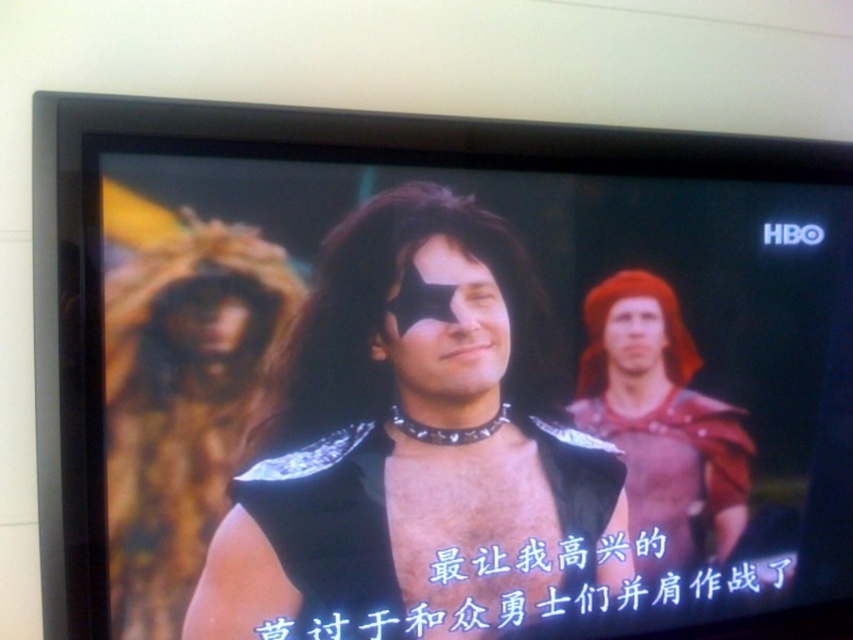
You are a character in the fantasy drama scene. You need to move from the shiny black armor at center to the red leather armor at right. Which direction should you move to reach it?

The shiny black armor at center is to the left of red leather armor at right, so you should move to the right to reach the red leather armor at right.

You are a costume designer preparing for a play. You have two armors to place on stage. The shiny black armor at center and the red leather armor at right. Which armor should you place closer to the audience to make it appear more dominant?

The shiny black armor at center is larger in size compared to the red leather armor at right. To make it appear more dominant, place it closer to the audience since its larger size will enhance its presence.

You are a character in the fantasy drama scene. You need to locate the shiny black armor at center to retrieve a hidden key. Based on the coordinates provided, where exactly should you look on the screen to find it?

The shiny black armor at center is located at coordinates point (416, 449), so you should look at that specific point on the screen to find it.